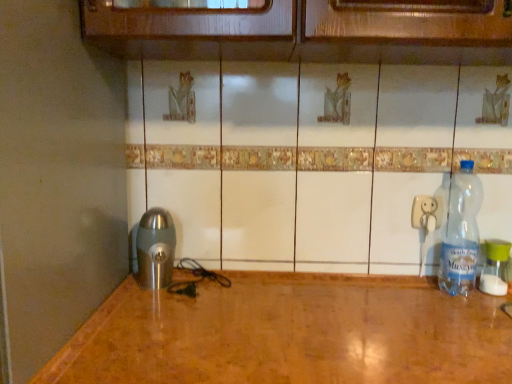
What are the coordinates of `white plastic electric outlet at right` in the screenshot? It's located at (426, 213).

Measure the distance between point (413, 227) and camera.

The depth of point (413, 227) is 3.70 feet.

At what (x,y) coordinates should I click in order to perform the action: click on transparent plastic bottle at right, the second bottle from the right. Please return your answer as a coordinate pair (x, y). This screenshot has width=512, height=384. Looking at the image, I should click on (461, 233).

Which is farther from the camera, [425,211] or [476,200]?

The point [476,200] is behind.

Find the location of a particular element. The height and width of the screenshot is (384, 512). bottle that is the 1st one below the white plastic electric outlet at right (from a real-world perspective) is located at coordinates (461, 233).

Can you confirm if white plastic electric outlet at right is wider than transparent plastic bottle at right, the second bottle from the right?

No.

Consider the image. Is transparent plastic bottle at right, the second bottle from the right, oriented towards white plastic electric outlet at right?

No, transparent plastic bottle at right, the second bottle from the right, is not turned towards white plastic electric outlet at right.

From a real-world perspective, who is located higher, transparent plastic bottle at right, the 1th bottle when ordered from left to right, or white plastic electric outlet at right?

white plastic electric outlet at right is physically above.

You are a GUI agent. You are given a task and a screenshot of the screen. Output one action in this format:
    pyautogui.click(x=<x>, y=<y>)
    Task: Click on the electric outlet behind the transparent plastic bottle at right, the second bottle from the right
    The width and height of the screenshot is (512, 384).
    Given the screenshot: What is the action you would take?
    pyautogui.click(x=426, y=213)

Can you confirm if transparent plastic bottle at right, the 1th bottle when ordered from left to right, is smaller than white plastic electric outlet at right?

No, transparent plastic bottle at right, the 1th bottle when ordered from left to right, is not smaller than white plastic electric outlet at right.

In order to click on bottle in front of the clear plastic bottle at right, which is the 2th bottle from left to right in this screenshot , I will do `click(461, 233)`.

From a real-world perspective, which is physically above, transparent plastic bottle at right, the 1th bottle when ordered from left to right, or clear plastic bottle at right, which is the 2th bottle from left to right?

In real-world perspective, transparent plastic bottle at right, the 1th bottle when ordered from left to right, is above.

Does transparent plastic bottle at right, the second bottle from the right, lie in front of clear plastic bottle at right, which is the 2th bottle from left to right?

→ Yes, transparent plastic bottle at right, the second bottle from the right, is closer to the viewer.

Does transparent plastic bottle at right, the 1th bottle when ordered from left to right, appear on the right side of clear plastic bottle at right, the first bottle positioned from the right?

No.

From the image's perspective, is transparent plastic bottle at right, the 1th bottle when ordered from left to right, located above or below brushed metal coffee grinder at lower left?

Based on their image positions, transparent plastic bottle at right, the 1th bottle when ordered from left to right, is located above brushed metal coffee grinder at lower left.

Does point (445, 269) come farther from viewer compared to point (156, 258)?

Yes, point (445, 269) is farther from viewer.

Between transparent plastic bottle at right, the 1th bottle when ordered from left to right, and brushed metal coffee grinder at lower left, which one is positioned behind?

brushed metal coffee grinder at lower left is further away from the camera.

Looking at this image, can you tell me how much transparent plastic bottle at right, the 1th bottle when ordered from left to right, and brushed metal coffee grinder at lower left differ in facing direction?

transparent plastic bottle at right, the 1th bottle when ordered from left to right, and brushed metal coffee grinder at lower left are facing 0.0013 degrees away from each other.

Can transparent plastic bottle at right, the 1th bottle when ordered from left to right, be found inside brushed metal coffee grinder at lower left?

No, transparent plastic bottle at right, the 1th bottle when ordered from left to right, is located outside of brushed metal coffee grinder at lower left.

From the image's perspective, does brushed metal coffee grinder at lower left appear lower than transparent plastic bottle at right, the 1th bottle when ordered from left to right?

Indeed, from the image's perspective, brushed metal coffee grinder at lower left is shown beneath transparent plastic bottle at right, the 1th bottle when ordered from left to right.

Considering the relative sizes of brushed metal coffee grinder at lower left and transparent plastic bottle at right, the second bottle from the right, in the image provided, is brushed metal coffee grinder at lower left shorter than transparent plastic bottle at right, the second bottle from the right,?

Yes, brushed metal coffee grinder at lower left is shorter than transparent plastic bottle at right, the second bottle from the right.

Is point (155, 265) closer or farther from the camera than point (461, 240)?

Point (155, 265) appears to be closer to the viewer than point (461, 240).

Which bottle is the 1st one when counting from the front of the white plastic electric outlet at right? Please provide its 2D coordinates.

[(495, 267)]

In the scene shown: In the image, is white plastic electric outlet at right positioned in front of or behind clear plastic bottle at right, which is the 2th bottle from left to right?

In the image, white plastic electric outlet at right appears behind clear plastic bottle at right, which is the 2th bottle from left to right.

Considering the sizes of objects white plastic electric outlet at right and clear plastic bottle at right, which is the 2th bottle from left to right, in the image provided, who is shorter, white plastic electric outlet at right or clear plastic bottle at right, which is the 2th bottle from left to right,?

Standing shorter between the two is white plastic electric outlet at right.

Can you tell me how much white plastic electric outlet at right and clear plastic bottle at right, the first bottle positioned from the right, differ in facing direction?

The angle between the facing direction of white plastic electric outlet at right and the facing direction of clear plastic bottle at right, the first bottle positioned from the right, is 0.0133 degrees.

Considering the sizes of objects brushed metal coffee grinder at lower left and white plastic electric outlet at right in the image provided, who is smaller, brushed metal coffee grinder at lower left or white plastic electric outlet at right?

white plastic electric outlet at right is smaller.

Does brushed metal coffee grinder at lower left have a lesser width compared to white plastic electric outlet at right?

In fact, brushed metal coffee grinder at lower left might be wider than white plastic electric outlet at right.

Between brushed metal coffee grinder at lower left and white plastic electric outlet at right, which one appears on the right side from the viewer's perspective?

white plastic electric outlet at right.

This screenshot has height=384, width=512. There is a white plastic electric outlet at right. What are the coordinates of `the 1st bottle below it (from a real-world perspective)` in the screenshot? It's located at (461, 233).

This screenshot has height=384, width=512. Identify the location of electric outlet above the transparent plastic bottle at right, the 1th bottle when ordered from left to right (from a real-world perspective). (426, 213).

Considering their positions, is brushed metal coffee grinder at lower left positioned further to white plastic electric outlet at right than clear plastic bottle at right, which is the 2th bottle from left to right?

brushed metal coffee grinder at lower left lies further to white plastic electric outlet at right than the other object.

Estimate the real-world distances between objects in this image. Which object is further from white plastic electric outlet at right, clear plastic bottle at right, the first bottle positioned from the right, or brushed metal coffee grinder at lower left?

brushed metal coffee grinder at lower left is further to white plastic electric outlet at right.

Which object lies nearer to the anchor point brushed metal coffee grinder at lower left, transparent plastic bottle at right, the 1th bottle when ordered from left to right, or clear plastic bottle at right, the first bottle positioned from the right?

transparent plastic bottle at right, the 1th bottle when ordered from left to right, is positioned closer to the anchor brushed metal coffee grinder at lower left.

Estimate the real-world distances between objects in this image. Which object is closer to brushed metal coffee grinder at lower left, white plastic electric outlet at right or transparent plastic bottle at right, the 1th bottle when ordered from left to right?

white plastic electric outlet at right lies closer to brushed metal coffee grinder at lower left than the other object.

Looking at the image, which one is located closer to brushed metal coffee grinder at lower left, transparent plastic bottle at right, the second bottle from the right, or white plastic electric outlet at right?

Among the two, white plastic electric outlet at right is located nearer to brushed metal coffee grinder at lower left.

When comparing their distances from clear plastic bottle at right, which is the 2th bottle from left to right, does white plastic electric outlet at right or brushed metal coffee grinder at lower left seem closer?

The object closer to clear plastic bottle at right, which is the 2th bottle from left to right, is white plastic electric outlet at right.

Based on their spatial positions, is white plastic electric outlet at right or clear plastic bottle at right, the first bottle positioned from the right, closer to brushed metal coffee grinder at lower left?

Based on the image, white plastic electric outlet at right appears to be nearer to brushed metal coffee grinder at lower left.

Considering their positions, is brushed metal coffee grinder at lower left positioned further to transparent plastic bottle at right, the 1th bottle when ordered from left to right, than clear plastic bottle at right, the first bottle positioned from the right?

brushed metal coffee grinder at lower left is positioned further to the anchor transparent plastic bottle at right, the 1th bottle when ordered from left to right.

The height and width of the screenshot is (384, 512). I want to click on bottle between brushed metal coffee grinder at lower left and clear plastic bottle at right, which is the 2th bottle from left to right, from left to right, so click(x=461, y=233).

Find the location of a particular element. This screenshot has height=384, width=512. bottle located between white plastic electric outlet at right and clear plastic bottle at right, the first bottle positioned from the right, in the left-right direction is located at coordinates (461, 233).

The image size is (512, 384). In order to click on electric outlet situated between brushed metal coffee grinder at lower left and clear plastic bottle at right, which is the 2th bottle from left to right, from left to right in this screenshot , I will do `click(426, 213)`.

Where is `electric outlet located between brushed metal coffee grinder at lower left and transparent plastic bottle at right, the 1th bottle when ordered from left to right, in the left-right direction`? electric outlet located between brushed metal coffee grinder at lower left and transparent plastic bottle at right, the 1th bottle when ordered from left to right, in the left-right direction is located at coordinates (426, 213).